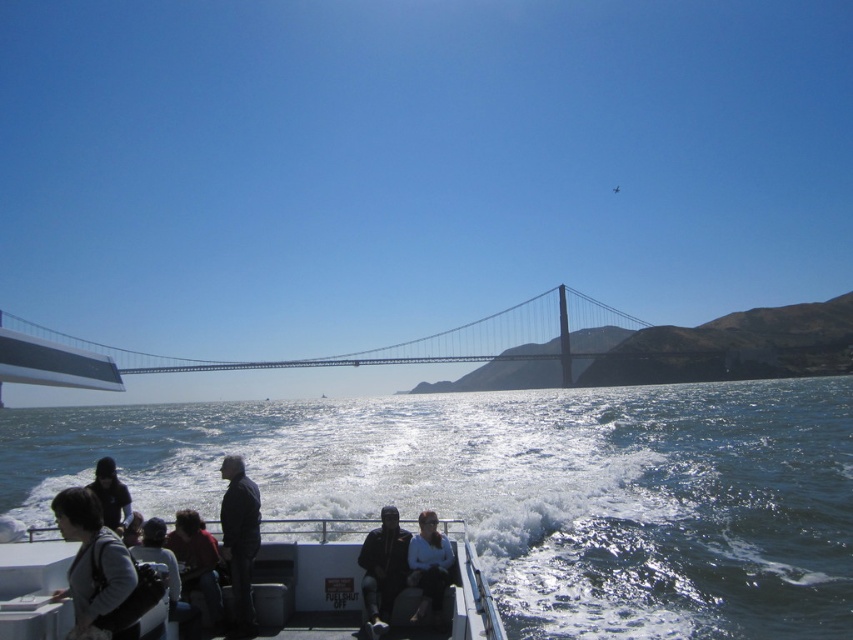
Question: Is dark blue fabric at center wider than white fabric shirt at center?

Choices:
 (A) yes
 (B) no

Answer: (A)

Question: Based on their relative distances, which object is nearer to the dark brown leather jacket at lower left?

Choices:
 (A) clear blue water at lower center
 (B) white fabric shirt at center

Answer: (B)

Question: Is gray fabric jacket at lower left to the left of matte black jacket at lower left from the viewer's perspective?

Choices:
 (A) no
 (B) yes

Answer: (B)

Question: Which point appears closest to the camera in this image?

Choices:
 (A) coord(119,627)
 (B) coord(381,584)
 (C) coord(259,502)
 (D) coord(204,595)

Answer: (A)

Question: Can you confirm if white plastic boat at lower left is positioned below white fabric shirt at center?

Choices:
 (A) yes
 (B) no

Answer: (A)

Question: Among these objects, which one is nearest to the camera?

Choices:
 (A) dark brown leather jacket at lower left
 (B) matte black jacket at lower left
 (C) white plastic boat at lower left

Answer: (C)